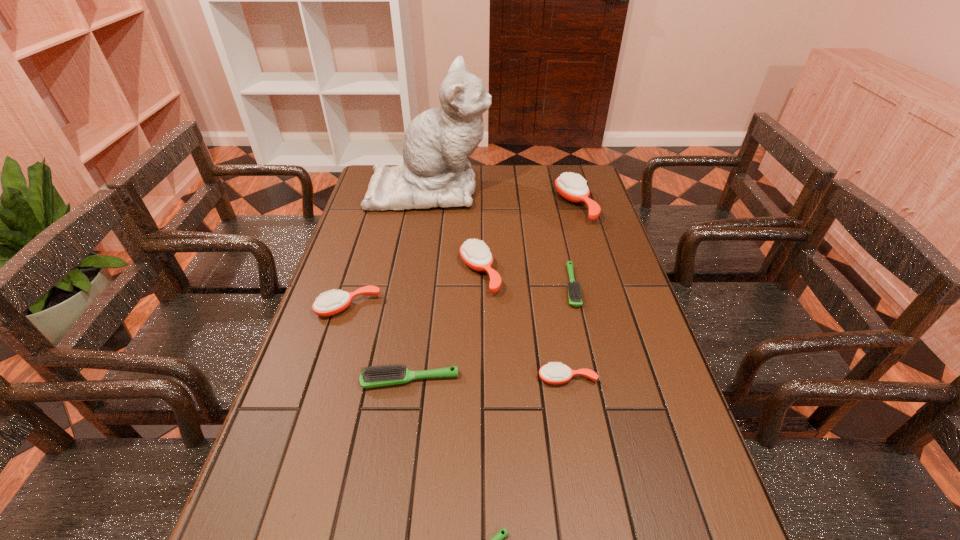
What are the coordinates of `the second biggest light hairbrush` in the screenshot? It's located at (574, 291).

The height and width of the screenshot is (540, 960). Find the location of `the farthest light hairbrush`. the farthest light hairbrush is located at coordinates 574,291.

At what (x,y) coordinates should I click in order to perform the action: click on free space located on the front-facing side of the tallest object. Please return your answer as a coordinate pair (x, y). This screenshot has height=540, width=960. Looking at the image, I should click on (554, 189).

Where is `vacant space located 0.130m on the back of the tallest hairbrush`? vacant space located 0.130m on the back of the tallest hairbrush is located at coordinates (564, 170).

Where is `vacant area situated on the right of the third orange hairbrush from right to left`? vacant area situated on the right of the third orange hairbrush from right to left is located at coordinates (534, 273).

This screenshot has width=960, height=540. What are the coordinates of `vacant space located 0.190m on the front of the fifth shortest object` in the screenshot? It's located at (325, 381).

This screenshot has width=960, height=540. I want to click on vacant space located 0.350m on the right of the biggest light hairbrush, so click(x=608, y=381).

Find the location of a particular element. free space located 0.110m on the front of the smallest orange hairbrush is located at coordinates pyautogui.click(x=576, y=432).

Identify the location of free location located on the back of the sixth tallest hairbrush. Image resolution: width=960 pixels, height=540 pixels. (555, 213).

Image resolution: width=960 pixels, height=540 pixels. Identify the location of cat that is positioned at the far edge. (435, 172).